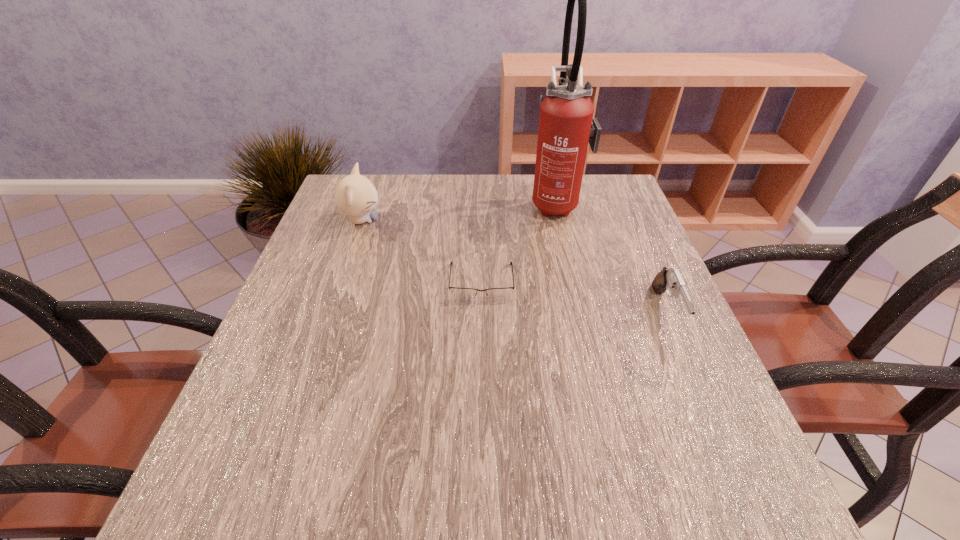
Find the location of a particular element. The width and height of the screenshot is (960, 540). free region located 0.210m at the nozzle of the tallest object is located at coordinates (452, 204).

Identify the location of free space located 0.320m on the face of the third shortest object. (507, 220).

Identify the location of free space located at the muzzle of the rightmost object. The width and height of the screenshot is (960, 540). (719, 435).

Image resolution: width=960 pixels, height=540 pixels. I want to click on blank area located on the front-facing side of the spectacles, so (x=482, y=388).

Locate an element on the screen. The image size is (960, 540). fire extinguisher that is at the far edge is located at coordinates (566, 125).

What are the coordinates of `kitten that is at the far edge` in the screenshot? It's located at (355, 195).

Identify the location of object that is at the left edge. This screenshot has width=960, height=540. (355, 195).

At what (x,y) coordinates should I click in order to perform the action: click on fire extinguisher located in the right edge section of the desktop. Please return your answer as a coordinate pair (x, y). Looking at the image, I should click on (566, 125).

Identify the location of gun that is at the right edge. Image resolution: width=960 pixels, height=540 pixels. (670, 277).

Identify the location of object located at the far left corner. The width and height of the screenshot is (960, 540). coord(355,195).